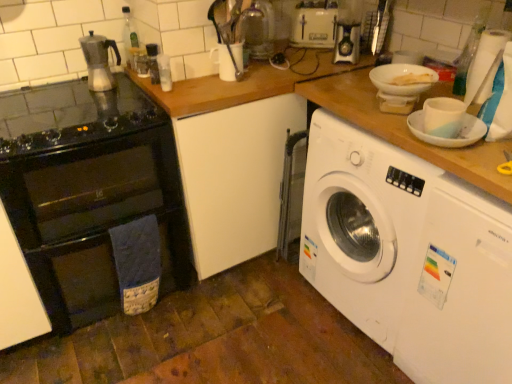
Question: Is black glass oven at left aimed at transparent plastic bottle at upper right, which is counted as the 1th bottle, starting from the right?

Choices:
 (A) no
 (B) yes

Answer: (A)

Question: Can you confirm if black glass oven at left is smaller than transparent plastic bottle at upper right, which is counted as the 1th bottle, starting from the right?

Choices:
 (A) yes
 (B) no

Answer: (B)

Question: Is black glass oven at left facing away from transparent plastic bottle at upper right, which is counted as the 1th bottle, starting from the right?

Choices:
 (A) yes
 (B) no

Answer: (B)

Question: From the image's perspective, is black glass oven at left on top of transparent plastic bottle at upper right, which is counted as the 1th bottle, starting from the right?

Choices:
 (A) no
 (B) yes

Answer: (A)

Question: Is black glass oven at left positioned behind transparent plastic bottle at upper right, which is counted as the 1th bottle, starting from the right?

Choices:
 (A) no
 (B) yes

Answer: (A)

Question: From a real-world perspective, relative to translucent glass kettle at upper center, the 2th appliance positioned from the bottom, is white glossy bowl at upper right vertically above or below?

Choices:
 (A) below
 (B) above

Answer: (A)

Question: In terms of width, does white glossy bowl at upper right look wider or thinner when compared to translucent glass kettle at upper center, the second appliance viewed from the front?

Choices:
 (A) wide
 (B) thin

Answer: (B)

Question: Considering their positions, is white glossy bowl at upper right located in front of or behind translucent glass kettle at upper center, the 2th appliance positioned from the bottom?

Choices:
 (A) behind
 (B) front

Answer: (B)

Question: Looking at the image, does white glossy bowl at upper right seem bigger or smaller compared to translucent glass kettle at upper center, the 2th appliance positioned from the bottom?

Choices:
 (A) small
 (B) big

Answer: (A)

Question: Looking at the image, does black glass gas stove at left seem bigger or smaller compared to black glass oven at left?

Choices:
 (A) big
 (B) small

Answer: (B)

Question: Is point (49, 137) positioned closer to the camera than point (65, 130)?

Choices:
 (A) closer
 (B) farther

Answer: (A)

Question: From the image's perspective, is black glass gas stove at left positioned above or below black glass oven at left?

Choices:
 (A) below
 (B) above

Answer: (B)

Question: Relative to black glass oven at left, is black glass gas stove at left in front or behind?

Choices:
 (A) front
 (B) behind

Answer: (A)

Question: From the image's perspective, relative to white glossy bowl at upper right, is black glass oven at left above or below?

Choices:
 (A) above
 (B) below

Answer: (B)

Question: Is black glass oven at left in front of or behind white glossy bowl at upper right in the image?

Choices:
 (A) behind
 (B) front

Answer: (A)